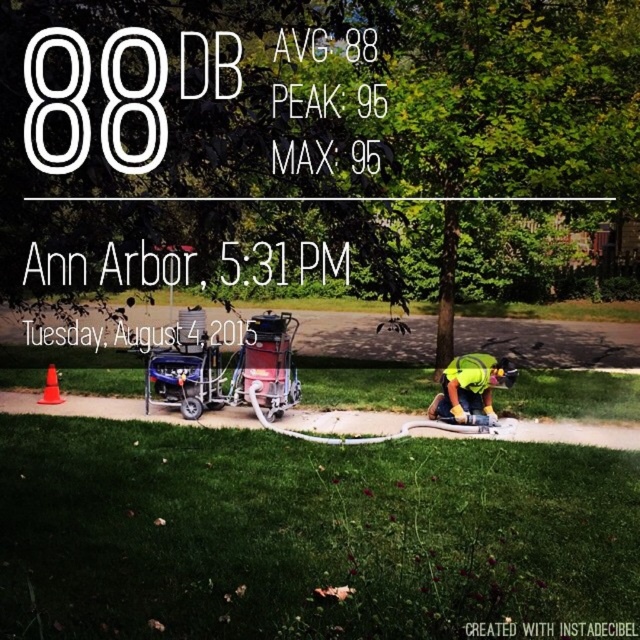
You are a delivery person who needs to place a package on the metallic blue cart at center. However, there is an orange plastic cone at lower left nearby. Where should you place the package so it won not fall off the cart?

Place the package away from the edge of the metallic blue cart at center that is positioned over the orange plastic cone at lower left to prevent it from falling off.

You are standing at the orange plastic cone at lower left and want to move towards the metallic blue cart at center. Which direction should you walk?

You should walk to the right because the metallic blue cart at center is located to the right of the orange plastic cone at lower left.

You are a delivery person who needs to pick up the yellow reflective safety vest at lower right from the grassy area. The metallic blue cart at center is blocking your path. Can you move the cart to access the vest?

The metallic blue cart at center is positioned over yellow reflective safety vest at lower right, so you cannot access the vest without moving the cart first.